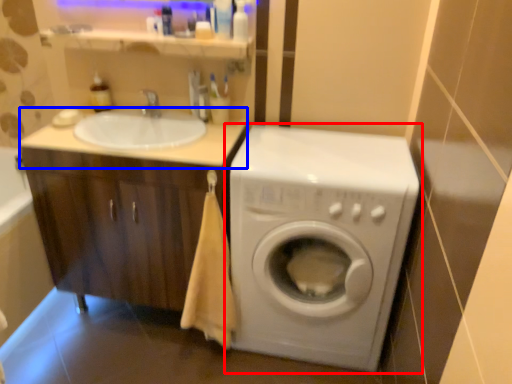
Question: Among these objects, which one is nearest to the camera, washing machine (highlighted by a red box) or counter top (highlighted by a blue box)?

Choices:
 (A) washing machine
 (B) counter top

Answer: (A)